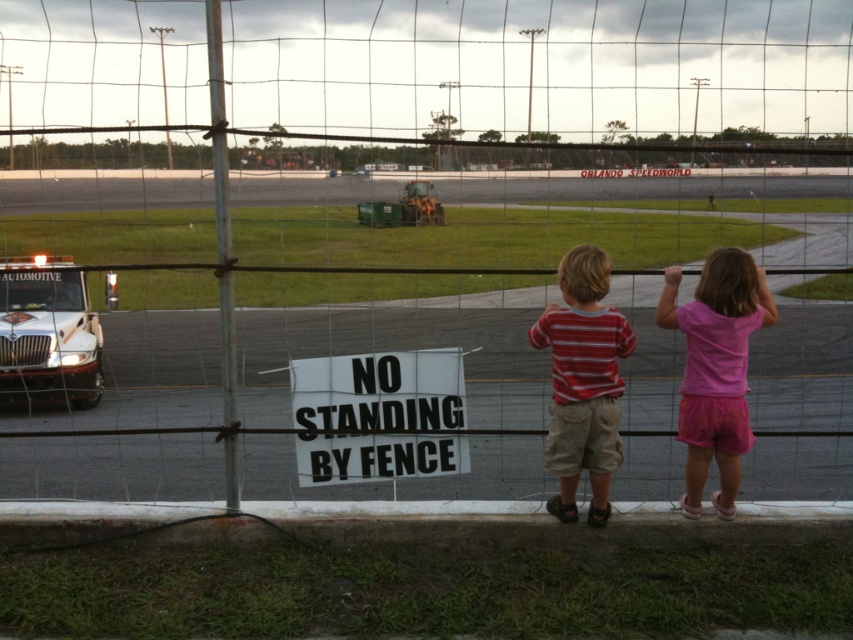
Is point (399, 428) farther from viewer compared to point (84, 289)?

That is False.

Is point (451, 467) in front of point (21, 349)?

That is True.

You are a GUI agent. You are given a task and a screenshot of the screen. Output one action in this format:
    pyautogui.click(x=<x>, y=<y>)
    Task: Click on the white paper sign at center
    The height and width of the screenshot is (640, 853).
    Given the screenshot: What is the action you would take?
    pyautogui.click(x=378, y=416)

Does white paper sign at center have a greater height compared to pink fabric shorts at center?

No, white paper sign at center is not taller than pink fabric shorts at center.

Between point (299, 429) and point (704, 380), which one is positioned in front?

Positioned in front is point (704, 380).

Describe the element at coordinates (378, 416) in the screenshot. The height and width of the screenshot is (640, 853). I see `white paper sign at center` at that location.

Locate an element on the screen. The image size is (853, 640). white paper sign at center is located at coordinates (378, 416).

Is striped cotton shirt at center thinner than pink fabric shorts at center?

Correct, striped cotton shirt at center's width is less than pink fabric shorts at center's.

Can you confirm if striped cotton shirt at center is positioned above pink fabric shorts at center?

Yes, striped cotton shirt at center is above pink fabric shorts at center.

Image resolution: width=853 pixels, height=640 pixels. What are the coordinates of `striped cotton shirt at center` in the screenshot? It's located at (583, 381).